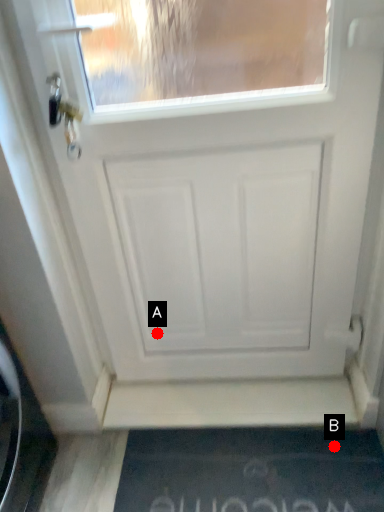
Question: Two points are circled on the image, labeled by A and B beside each circle. Which point is closer to the camera?

Choices:
 (A) A is closer
 (B) B is closer

Answer: (B)